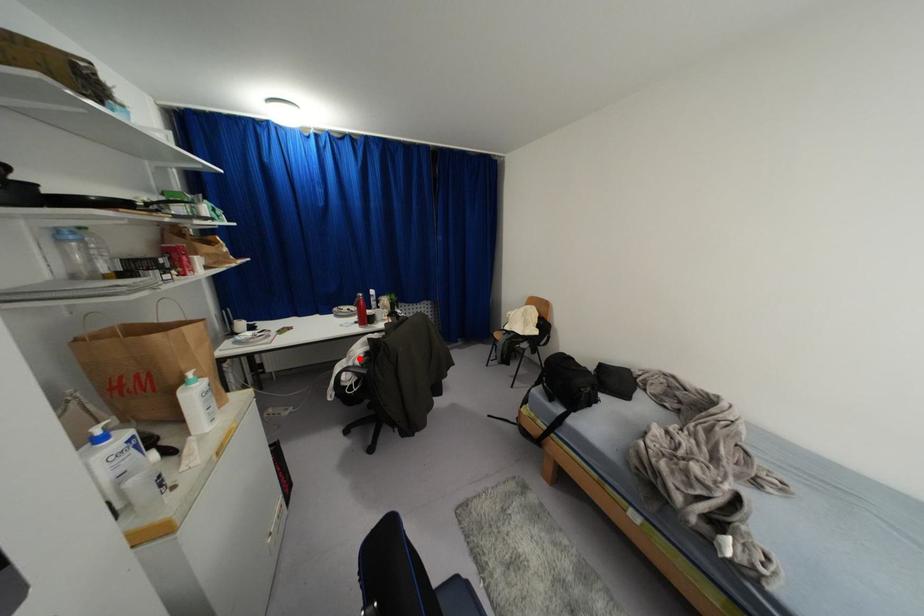
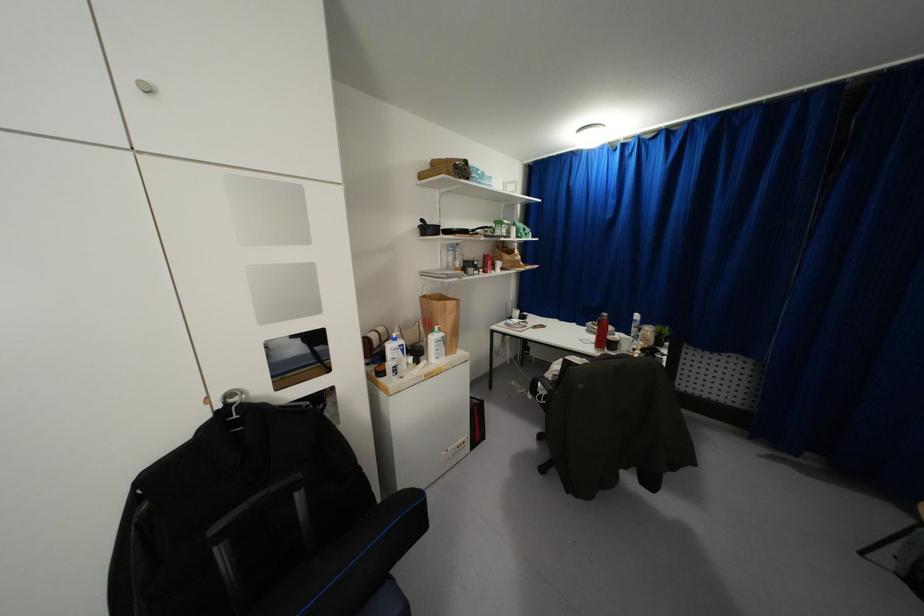
Question: I am providing you with two images of the same scene from different viewpoints. Image1 has a red point marked. In image2, the corresponding 3D location appears at what relative position? Reply with the corresponding letter.

Choices:
 (A) Closer
 (B) Farther

Answer: (A)